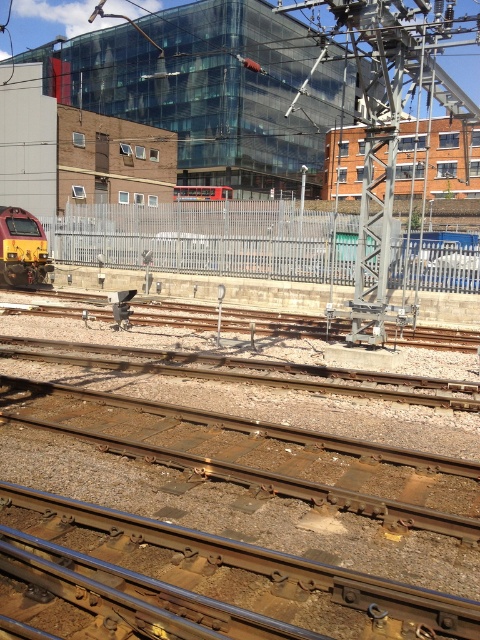
You are a railway inspector checking the track spacing. The standard track width is 1.4 meters. You observe the yellow metallic train at left and the red metallic train at center. Which train would require a wider track spacing to accommodate its width?

The red metallic train at center requires wider track spacing because its width is greater than the yellow metallic train at left, as stated in the description.

You are a maintenance worker assigned to inspect the tracks between the metal at center and the yellow metallic train at left. The safety protocol requires a minimum distance of 60 feet between the inspection point and any active train. Is the current distance compliant with the safety protocol?

The distance between the metal at center and the yellow metallic train at left is 63.47 feet, which exceeds the required 60 feet minimum. Therefore, the current distance is compliant with the safety protocol.